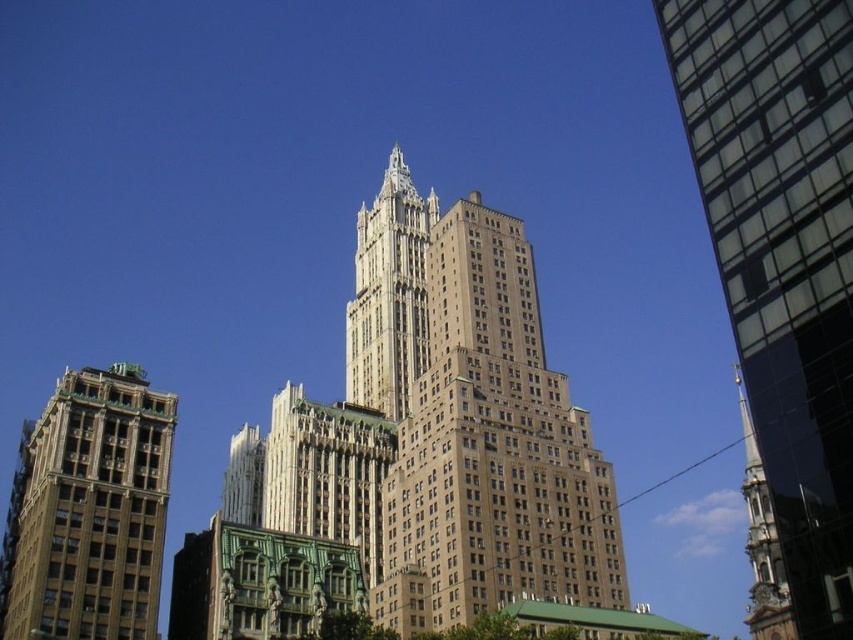
Question: Which point is closer to the camera taking this photo?

Choices:
 (A) (770, 406)
 (B) (93, 374)

Answer: (A)

Question: Which object appears farthest from the camera in this image?

Choices:
 (A) glassy reflective skyscraper at right
 (B) gold stone tower at center

Answer: (B)

Question: Where is glassy reflective skyscraper at right located in relation to brown stone tower at left in the image?

Choices:
 (A) below
 (B) above

Answer: (B)

Question: Does glassy reflective skyscraper at right appear over brown stone tower at left?

Choices:
 (A) no
 (B) yes

Answer: (B)

Question: Which point appears farthest from the camera in this image?

Choices:
 (A) (361, 342)
 (B) (821, 160)

Answer: (A)

Question: Where is brown stone tower at left located in relation to gold stone tower at center in the image?

Choices:
 (A) right
 (B) left

Answer: (B)